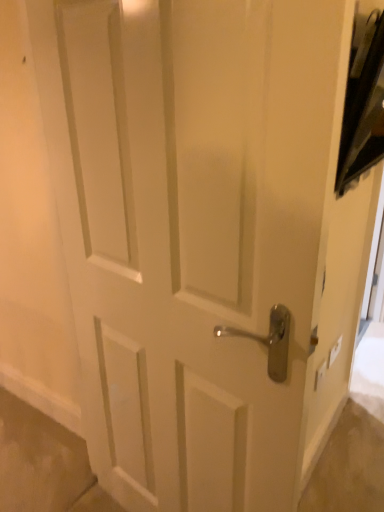
Locate an element on the screen. white plastic light switch at lower right, which is counted as the first light switch, starting from the left is located at coordinates click(320, 374).

Measure the distance between white plastic light switch at lower right, the first light switch when ordered from front to back, and camera.

A distance of 1.44 meters exists between white plastic light switch at lower right, the first light switch when ordered from front to back, and camera.

Describe the element at coordinates (320, 374) in the screenshot. I see `white plastic light switch at lower right, which is counted as the first light switch, starting from the left` at that location.

Measure the distance between point (321, 375) and camera.

The distance of point (321, 375) from camera is 5.00 feet.

Where is `white plastic light switch at upper right, the 2th light switch in the front-to-back sequence`? white plastic light switch at upper right, the 2th light switch in the front-to-back sequence is located at coordinates (334, 351).

Describe the element at coordinates (334, 351) in the screenshot. The image size is (384, 512). I see `white plastic light switch at upper right, which appears as the 2th light switch when viewed from the left` at that location.

You are a GUI agent. You are given a task and a screenshot of the screen. Output one action in this format:
    pyautogui.click(x=<x>, y=<y>)
    Task: Click on the white plastic light switch at lower right, which is counted as the 2th light switch, starting from the right
    
    Given the screenshot: What is the action you would take?
    pyautogui.click(x=320, y=374)

Is white plastic light switch at lower right, arranged as the second light switch when viewed from the back, at the right side of white plastic light switch at upper right, the first light switch viewed from the back?

Incorrect, white plastic light switch at lower right, arranged as the second light switch when viewed from the back, is not on the right side of white plastic light switch at upper right, the first light switch viewed from the back.

Is white plastic light switch at lower right, arranged as the second light switch when viewed from the back, positioned in front of white plastic light switch at upper right, the first light switch viewed from the back?

Yes, the depth of white plastic light switch at lower right, arranged as the second light switch when viewed from the back, is less than that of white plastic light switch at upper right, the first light switch viewed from the back.

Is point (325, 367) farther from viewer compared to point (333, 356)?

No, it is in front of (333, 356).

From the image's perspective, which object appears higher, white plastic light switch at lower right, which is counted as the first light switch, starting from the left, or white plastic light switch at upper right, positioned as the 1th light switch in right-to-left order?

white plastic light switch at upper right, positioned as the 1th light switch in right-to-left order, from the image's perspective.

From a real-world perspective, is white plastic light switch at lower right, arranged as the second light switch when viewed from the back, physically above white plastic light switch at upper right, positioned as the 1th light switch in right-to-left order?

Yes, from a real-world perspective, white plastic light switch at lower right, arranged as the second light switch when viewed from the back, is on top of white plastic light switch at upper right, positioned as the 1th light switch in right-to-left order.

In terms of width, does white plastic light switch at lower right, the first light switch when ordered from front to back, look wider or thinner when compared to white plastic light switch at upper right, the 2th light switch in the front-to-back sequence?

In the image, white plastic light switch at lower right, the first light switch when ordered from front to back, appears to be more narrow than white plastic light switch at upper right, the 2th light switch in the front-to-back sequence.

Between white plastic light switch at lower right, arranged as the second light switch when viewed from the back, and white plastic light switch at upper right, positioned as the 1th light switch in right-to-left order, which one has less height?

white plastic light switch at upper right, positioned as the 1th light switch in right-to-left order.

Who is smaller, white plastic light switch at lower right, arranged as the second light switch when viewed from the back, or white plastic light switch at upper right, the 2th light switch in the front-to-back sequence?

With smaller size is white plastic light switch at lower right, arranged as the second light switch when viewed from the back.

Is white plastic light switch at lower right, which is counted as the first light switch, starting from the left, completely or partially outside of white plastic light switch at upper right, positioned as the 1th light switch in right-to-left order?

That's correct, white plastic light switch at lower right, which is counted as the first light switch, starting from the left, is outside of white plastic light switch at upper right, positioned as the 1th light switch in right-to-left order.

Is white plastic light switch at lower right, the first light switch when ordered from front to back, not close to white plastic light switch at upper right, the first light switch viewed from the back?

No, white plastic light switch at lower right, the first light switch when ordered from front to back, is not far from white plastic light switch at upper right, the first light switch viewed from the back.

Is white plastic light switch at lower right, which is counted as the first light switch, starting from the left, facing towards white plastic light switch at upper right, which appears as the 2th light switch when viewed from the left?

No.

Image resolution: width=384 pixels, height=512 pixels. In order to click on light switch on the right of the white plastic light switch at lower right, which is counted as the first light switch, starting from the left in this screenshot , I will do `click(334, 351)`.

Which object is positioned more to the right, white plastic light switch at upper right, positioned as the 1th light switch in right-to-left order, or white plastic light switch at lower right, which is counted as the first light switch, starting from the left?

white plastic light switch at upper right, positioned as the 1th light switch in right-to-left order, is more to the right.

Is the position of white plastic light switch at upper right, positioned as the 1th light switch in right-to-left order, more distant than that of white plastic light switch at lower right, arranged as the second light switch when viewed from the back?

Yes, it is.

Between point (330, 360) and point (320, 378), which one is positioned behind?

Positioned behind is point (330, 360).

From the image's perspective, which is above, white plastic light switch at upper right, which appears as the 2th light switch when viewed from the left, or white plastic light switch at lower right, which is counted as the first light switch, starting from the left?

From the image's view, white plastic light switch at upper right, which appears as the 2th light switch when viewed from the left, is above.

From a real-world perspective, is white plastic light switch at upper right, which appears as the 2th light switch when viewed from the left, over white plastic light switch at lower right, which is counted as the 2th light switch, starting from the right?

No, from a real-world perspective, white plastic light switch at upper right, which appears as the 2th light switch when viewed from the left, is not over white plastic light switch at lower right, which is counted as the 2th light switch, starting from the right

Is white plastic light switch at upper right, positioned as the 1th light switch in right-to-left order, wider or thinner than white plastic light switch at lower right, the first light switch when ordered from front to back?

Clearly, white plastic light switch at upper right, positioned as the 1th light switch in right-to-left order, has less width compared to white plastic light switch at lower right, the first light switch when ordered from front to back.

From their relative heights in the image, would you say white plastic light switch at upper right, positioned as the 1th light switch in right-to-left order, is taller or shorter than white plastic light switch at lower right, arranged as the second light switch when viewed from the back?

Clearly, white plastic light switch at upper right, positioned as the 1th light switch in right-to-left order, is shorter compared to white plastic light switch at lower right, arranged as the second light switch when viewed from the back.

Considering the sizes of objects white plastic light switch at upper right, the first light switch viewed from the back, and white plastic light switch at lower right, which is counted as the 2th light switch, starting from the right, in the image provided, who is smaller, white plastic light switch at upper right, the first light switch viewed from the back, or white plastic light switch at lower right, which is counted as the 2th light switch, starting from the right,?

white plastic light switch at lower right, which is counted as the 2th light switch, starting from the right.

Would you say white plastic light switch at upper right, positioned as the 1th light switch in right-to-left order, is outside white plastic light switch at lower right, the first light switch when ordered from front to back?

Yes, white plastic light switch at upper right, positioned as the 1th light switch in right-to-left order, is not within white plastic light switch at lower right, the first light switch when ordered from front to back.

Is white plastic light switch at upper right, the first light switch viewed from the back, far from white plastic light switch at lower right, arranged as the second light switch when viewed from the back?

No, there isn't a large distance between white plastic light switch at upper right, the first light switch viewed from the back, and white plastic light switch at lower right, arranged as the second light switch when viewed from the back.

Is white plastic light switch at lower right, arranged as the second light switch when viewed from the back, at the back of white plastic light switch at upper right, the 2th light switch in the front-to-back sequence?

No, white plastic light switch at upper right, the 2th light switch in the front-to-back sequence, is not facing away from white plastic light switch at lower right, arranged as the second light switch when viewed from the back.

How different are the orientations of white plastic light switch at upper right, positioned as the 1th light switch in right-to-left order, and white plastic light switch at lower right, arranged as the second light switch when viewed from the back, in degrees?

The facing directions of white plastic light switch at upper right, positioned as the 1th light switch in right-to-left order, and white plastic light switch at lower right, arranged as the second light switch when viewed from the back, are 0 degrees apart.

This screenshot has height=512, width=384. I want to click on light switch beneath the white plastic light switch at lower right, arranged as the second light switch when viewed from the back (from a real-world perspective), so click(334, 351).

Identify the location of light switch on the left of white plastic light switch at upper right, positioned as the 1th light switch in right-to-left order. (320, 374).

Identify the location of light switch to the right of white plastic light switch at lower right, which is counted as the 2th light switch, starting from the right. This screenshot has height=512, width=384. (334, 351).